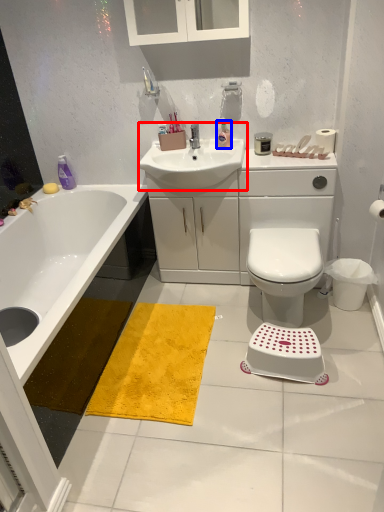
Question: Which of the following is the closest to the observer, sink (highlighted by a red box) or toiletry (highlighted by a blue box)?

Choices:
 (A) sink
 (B) toiletry

Answer: (A)